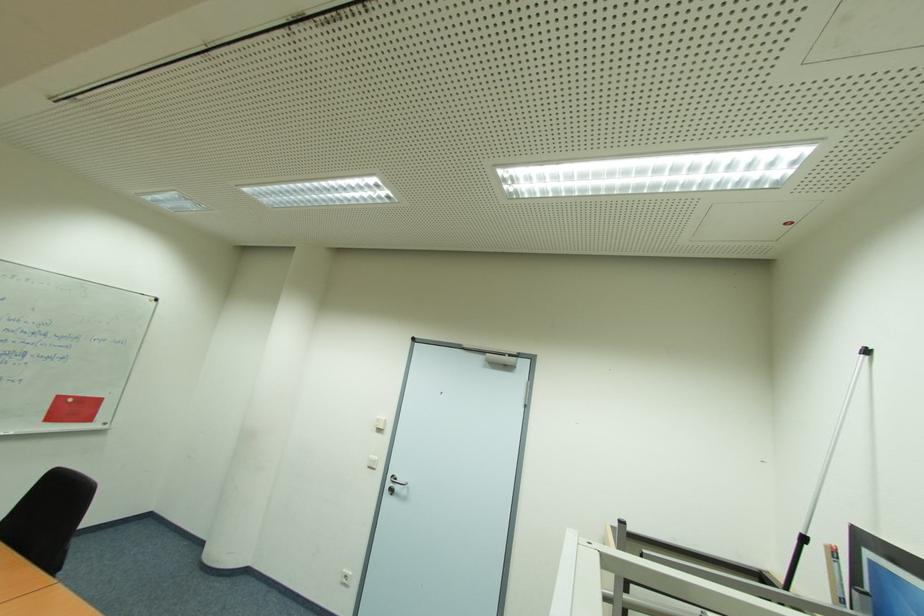
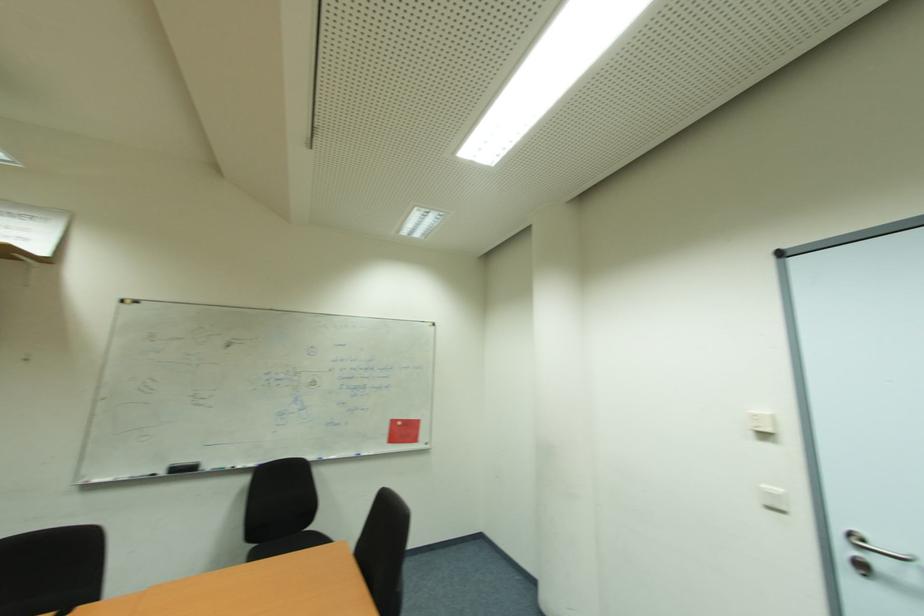
Find the pixel in the second image that matches (387,419) in the first image.

(771, 414)